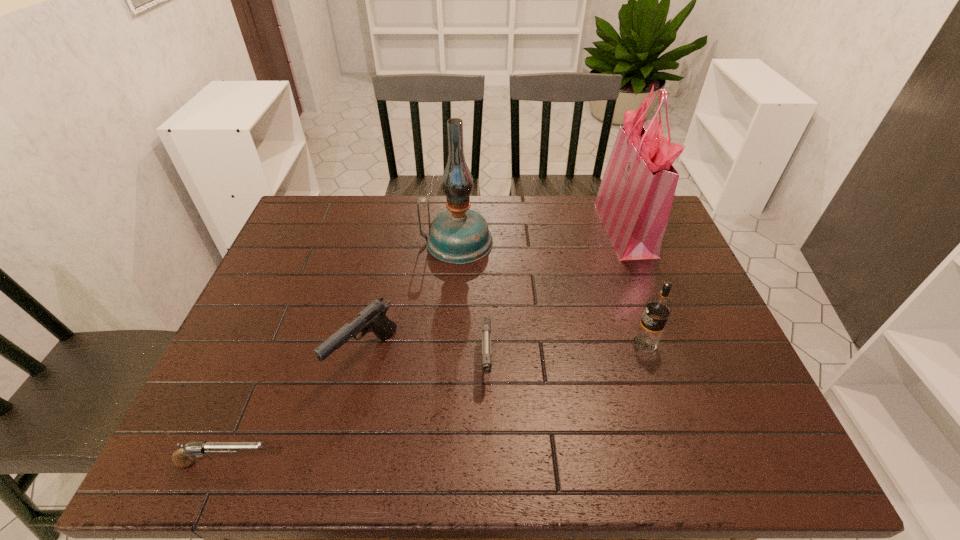
I want to click on vacant space positioned 0.270m on the right of the oil lamp, so click(x=580, y=242).

You are a GUI agent. You are given a task and a screenshot of the screen. Output one action in this format:
    pyautogui.click(x=<x>, y=<y>)
    Task: Click on the vacant space located 0.140m on the label of the third tallest object
    Image resolution: width=960 pixels, height=540 pixels.
    Given the screenshot: What is the action you would take?
    pos(575,343)

Identify the location of free space located 0.370m on the label of the third tallest object. (482, 343).

Identify the location of blank space located 0.050m on the label of the third tallest object. This screenshot has width=960, height=540. (612, 343).

Where is `free region located at the muzzle of the second object from left to right`? free region located at the muzzle of the second object from left to right is located at coordinates (344, 444).

Identify the location of free spot located in the direction the second tallest gun is aimed. (488, 458).

Find the location of a particular element. Image resolution: width=960 pixels, height=540 pixels. free space located aiming along the barrel of the leftmost gun is located at coordinates (315, 463).

Locate an element on the screen. This screenshot has height=540, width=960. shopping bag present at the far edge is located at coordinates (634, 201).

Locate an element on the screen. The image size is (960, 540). oil lamp that is at the far edge is located at coordinates (459, 235).

Identify the location of object present at the near edge. Image resolution: width=960 pixels, height=540 pixels. coord(181,458).